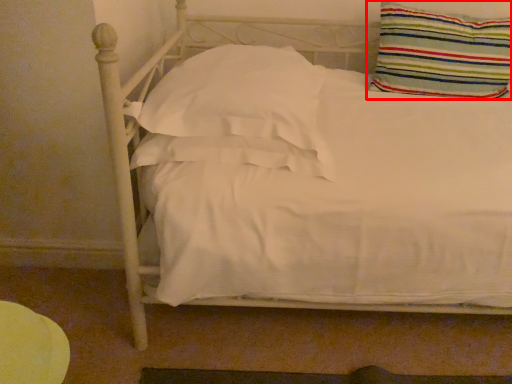
Question: From the image, what is the correct spatial relationship of pillow (annotated by the red box) in relation to pillow?

Choices:
 (A) right
 (B) left

Answer: (A)